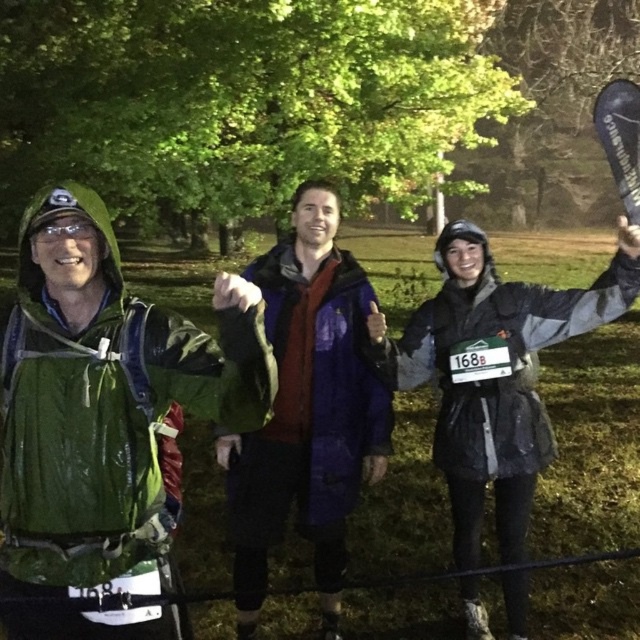
Between purple matte jacket at center and gray matte jacket at center, which one is positioned higher?

gray matte jacket at center is above.

Is point (269, 268) more distant than point (515, 310)?

Yes, it is behind point (515, 310).

The image size is (640, 640). I want to click on purple matte jacket at center, so click(x=307, y=410).